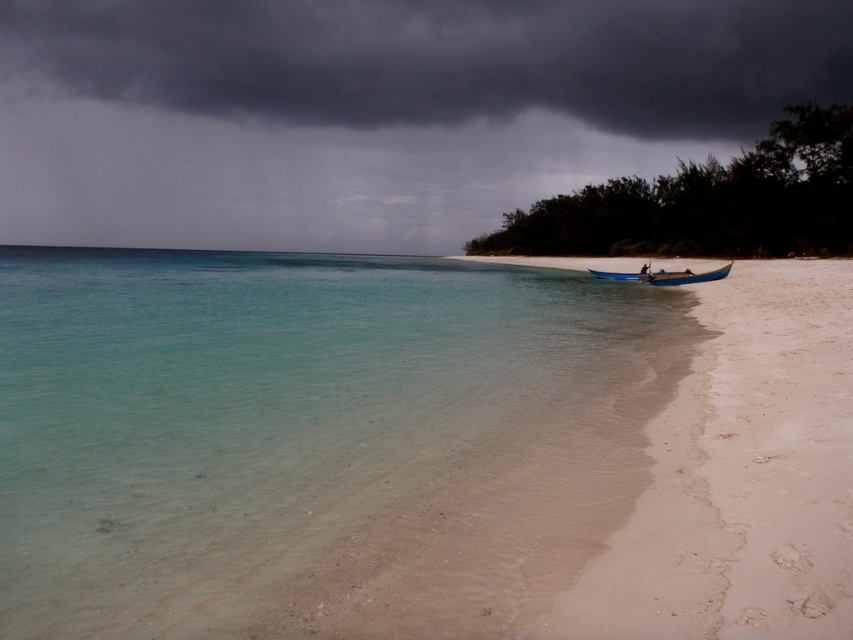
Does dark gray cloud at upper center have a smaller size compared to blue polished wood boat at lower right?

No.

Who is more forward, (538, 177) or (622, 280)?

Point (622, 280)

Between point (483, 13) and point (631, 276), which one is positioned in front?

Point (631, 276) is more forward.

Locate an element on the screen. This screenshot has width=853, height=640. dark gray cloud at upper center is located at coordinates (375, 109).

Is clear water at lower right shorter than blue polished wood boat at lower right?

In fact, clear water at lower right may be taller than blue polished wood boat at lower right.

Does point (315, 572) come behind point (662, 278)?

That is False.

This screenshot has height=640, width=853. Find the location of `clear water at lower right`. clear water at lower right is located at coordinates (312, 440).

The width and height of the screenshot is (853, 640). In order to click on clear water at lower right in this screenshot , I will do `click(312, 440)`.

Between point (483, 509) and point (407, 202), which one is positioned in front?

Positioned in front is point (483, 509).

Between clear water at lower right and dark gray cloud at upper center, which one is positioned higher?

dark gray cloud at upper center is higher up.

Is point (627, 355) positioned after point (35, 234)?

No, it is in front of (35, 234).

You are a GUI agent. You are given a task and a screenshot of the screen. Output one action in this format:
    pyautogui.click(x=<x>, y=<y>)
    Task: Click on the clear water at lower right
    The height and width of the screenshot is (640, 853).
    Given the screenshot: What is the action you would take?
    pyautogui.click(x=312, y=440)